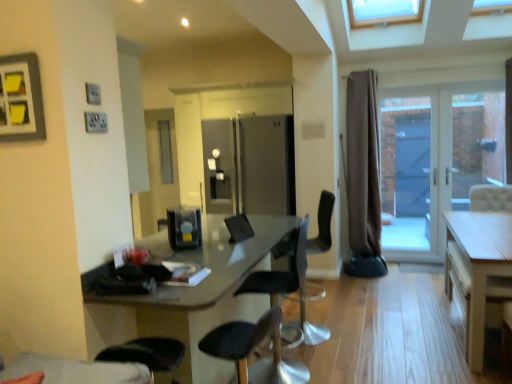
Question: Which direction should I rotate to look at black leather chair at center, which is the first chair in front-to-back order, — up or down?

Choices:
 (A) down
 (B) up

Answer: (A)

Question: Is satin black coffee machine at center positioned far away from clear glass door at right?

Choices:
 (A) yes
 (B) no

Answer: (A)

Question: From a real-world perspective, is satin black coffee machine at center physically below clear glass door at right?

Choices:
 (A) yes
 (B) no

Answer: (B)

Question: Is satin black coffee machine at center thinner than clear glass door at right?

Choices:
 (A) yes
 (B) no

Answer: (B)

Question: Is satin black coffee machine at center wider than clear glass door at right?

Choices:
 (A) yes
 (B) no

Answer: (A)

Question: Considering the relative sizes of satin black coffee machine at center and clear glass door at right in the image provided, is satin black coffee machine at center bigger than clear glass door at right?

Choices:
 (A) yes
 (B) no

Answer: (B)

Question: Can you see satin black coffee machine at center touching clear glass door at right?

Choices:
 (A) no
 (B) yes

Answer: (A)

Question: Is matte gray picture frame at upper left facing towards black plastic chair at center, arranged as the third chair when viewed from the front?

Choices:
 (A) no
 (B) yes

Answer: (A)

Question: From a real-world perspective, is matte gray picture frame at upper left positioned under black plastic chair at center, marked as the 1th chair in a back-to-front arrangement, based on gravity?

Choices:
 (A) yes
 (B) no

Answer: (B)

Question: Is matte gray picture frame at upper left outside black plastic chair at center, marked as the 1th chair in a back-to-front arrangement?

Choices:
 (A) yes
 (B) no

Answer: (A)

Question: Is matte gray picture frame at upper left bigger than black plastic chair at center, arranged as the third chair when viewed from the front?

Choices:
 (A) no
 (B) yes

Answer: (A)

Question: From the image's perspective, is matte gray picture frame at upper left on top of black plastic chair at center, marked as the 1th chair in a back-to-front arrangement?

Choices:
 (A) no
 (B) yes

Answer: (B)

Question: Is matte gray picture frame at upper left far away from black plastic chair at center, marked as the 1th chair in a back-to-front arrangement?

Choices:
 (A) yes
 (B) no

Answer: (A)

Question: Would you say matte gray picture frame at upper left is outside clear glass door at right?

Choices:
 (A) no
 (B) yes

Answer: (B)